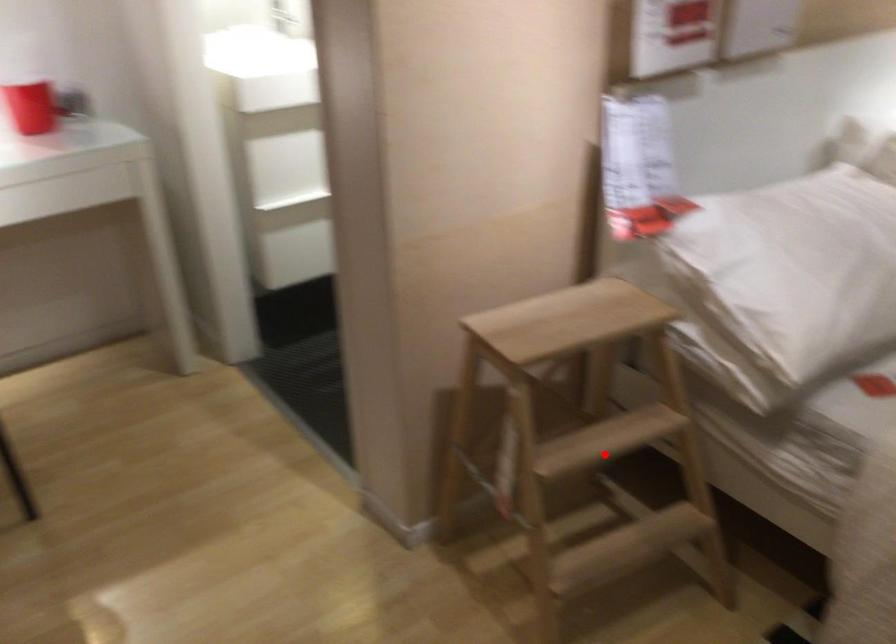
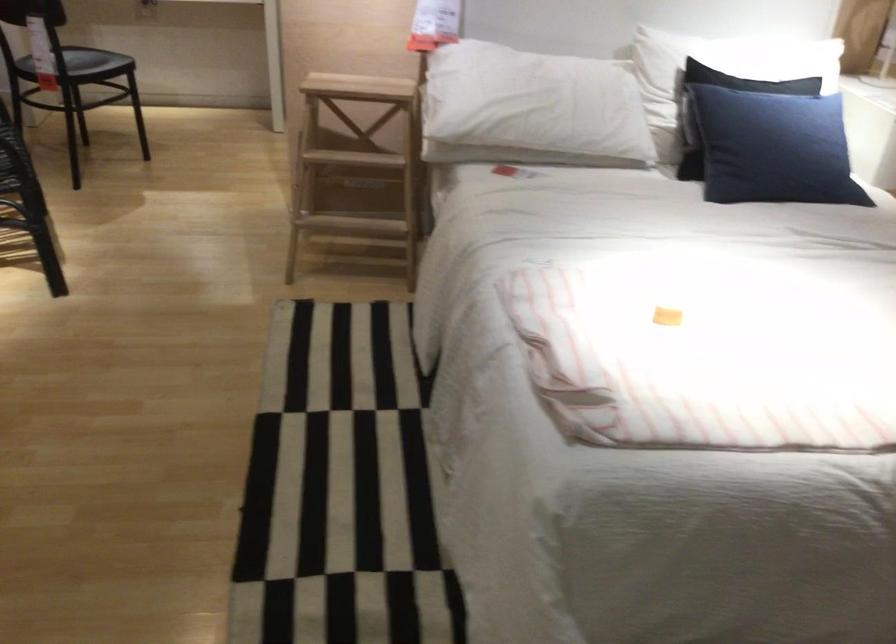
In the second image, find the point that corresponds to the highlighted location in the first image.

(357, 164)